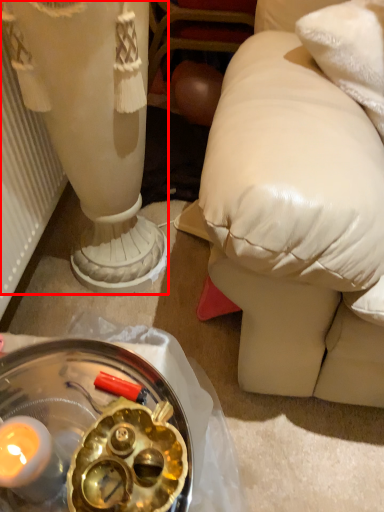
Question: From the image, what is the correct spatial relationship of sculpture (annotated by the red box) in relation to glass plate?

Choices:
 (A) right
 (B) left

Answer: (B)